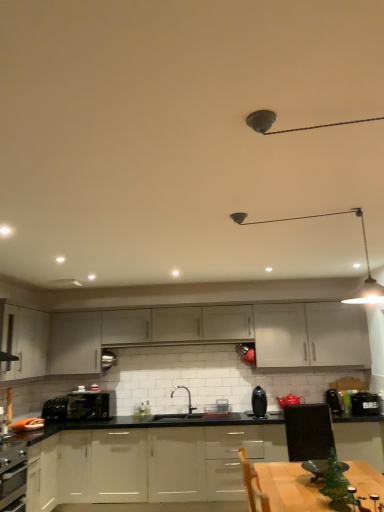
In order to click on white matte cabinet at center, positioned as the first cabinetry in top-to-bottom order in this screenshot , I will do `click(178, 324)`.

The height and width of the screenshot is (512, 384). Describe the element at coordinates (365, 254) in the screenshot. I see `metallic pendant light at upper center` at that location.

Identify the location of green matte christmas tree at lower right. (336, 484).

Identify the location of white glossy cabinets at center, which is the fourth cabinetry from top to bottom. The image size is (384, 512). (148, 464).

You are a GUI agent. You are given a task and a screenshot of the screen. Output one action in this format:
    pyautogui.click(x=<x>, y=<y>)
    Task: Click on the white matte cabinet at center, positioned as the first cabinetry in top-to-bottom order
    The image size is (384, 512).
    Given the screenshot: What is the action you would take?
    pyautogui.click(x=178, y=324)

Can you confirm if metallic silver toaster at center, placed as the 1th kitchen appliance when sorted from left to right, is positioned to the right of satin black vase at center, which appears as the 1th kitchen appliance when viewed from the front?

No, metallic silver toaster at center, placed as the 1th kitchen appliance when sorted from left to right, is not to the right of satin black vase at center, which appears as the 1th kitchen appliance when viewed from the front.

Between metallic silver toaster at center, acting as the second kitchen appliance starting from the right, and satin black vase at center, the 2th kitchen appliance viewed from the back, which one is positioned behind?

metallic silver toaster at center, acting as the second kitchen appliance starting from the right.

Considering the sizes of objects metallic silver toaster at center, which is the 2th kitchen appliance in front-to-back order, and satin black vase at center, which appears as the 1th kitchen appliance when viewed from the front, in the image provided, who is smaller, metallic silver toaster at center, which is the 2th kitchen appliance in front-to-back order, or satin black vase at center, which appears as the 1th kitchen appliance when viewed from the front,?

satin black vase at center, which appears as the 1th kitchen appliance when viewed from the front, is smaller.

Which object is positioned more to the left, metallic silver kettle at right, arranged as the first appliance when viewed from the right, or white matte cabinet at center, positioned as the first cabinetry in top-to-bottom order?

From the viewer's perspective, white matte cabinet at center, positioned as the first cabinetry in top-to-bottom order, appears more on the left side.

Is metallic silver kettle at right, arranged as the first appliance when viewed from the right, turned away from white matte cabinet at center, positioned as the first cabinetry in top-to-bottom order?

No, metallic silver kettle at right, arranged as the first appliance when viewed from the right,'s orientation is not away from white matte cabinet at center, positioned as the first cabinetry in top-to-bottom order.

From the image's perspective, starting from the white matte cabinet at center, the 4th cabinetry in the bottom-to-top sequence, which appliance is the 1st one below? Please provide its 2D coordinates.

[(334, 401)]

Could white matte cabinet at center, the 4th cabinetry in the bottom-to-top sequence, be considered to be inside metallic silver kettle at right, which appears as the first appliance when viewed from the front?

A: No, white matte cabinet at center, the 4th cabinetry in the bottom-to-top sequence, is not surrounded by metallic silver kettle at right, which appears as the first appliance when viewed from the front.

Are white glossy cabinets at center, marked as the first cabinetry in a bottom-to-top arrangement, and satin black vase at center, which appears as the 1th kitchen appliance when viewed from the front, located far from each other?

white glossy cabinets at center, marked as the first cabinetry in a bottom-to-top arrangement, is far away from satin black vase at center, which appears as the 1th kitchen appliance when viewed from the front.

Between white glossy cabinets at center, which is the fourth cabinetry from top to bottom, and satin black vase at center, the 1th kitchen appliance when ordered from right to left, which one appears on the left side from the viewer's perspective?

white glossy cabinets at center, which is the fourth cabinetry from top to bottom, is more to the left.

From a real-world perspective, is white glossy cabinets at center, marked as the first cabinetry in a bottom-to-top arrangement, positioned over satin black vase at center, the 2th kitchen appliance viewed from the back, based on gravity?

No, from a real-world perspective, white glossy cabinets at center, marked as the first cabinetry in a bottom-to-top arrangement, is not on top of satin black vase at center, the 2th kitchen appliance viewed from the back.

Is white glossy cabinets at center, which is the fourth cabinetry from top to bottom, looking in the opposite direction of satin black vase at center, the 1th kitchen appliance when ordered from right to left?

No, white glossy cabinets at center, which is the fourth cabinetry from top to bottom, is not facing away from satin black vase at center, the 1th kitchen appliance when ordered from right to left.

How different are the orientations of green matte christmas tree at lower right and white matte cabinet at center, the 4th cabinetry in the bottom-to-top sequence, in degrees?

74.5 degrees.

Considering the relative sizes of green matte christmas tree at lower right and white matte cabinet at center, the 4th cabinetry in the bottom-to-top sequence, in the image provided, is green matte christmas tree at lower right taller than white matte cabinet at center, the 4th cabinetry in the bottom-to-top sequence,?

No.

Between green matte christmas tree at lower right and white matte cabinet at center, the 4th cabinetry in the bottom-to-top sequence, which one appears on the right side from the viewer's perspective?

From the viewer's perspective, green matte christmas tree at lower right appears more on the right side.

Would you say green matte christmas tree at lower right is inside or outside white matte cabinet at center, the 4th cabinetry in the bottom-to-top sequence?

green matte christmas tree at lower right is located beyond the bounds of white matte cabinet at center, the 4th cabinetry in the bottom-to-top sequence.

Who is shorter, green matte christmas tree at lower right or black plastic toaster at lower left, which ranks as the second appliance in right-to-left order?

With less height is black plastic toaster at lower left, which ranks as the second appliance in right-to-left order.

Where is `christmas tree above the black plastic toaster at lower left, which is counted as the second appliance, starting from the front (from the image's perspective)`? The image size is (384, 512). christmas tree above the black plastic toaster at lower left, which is counted as the second appliance, starting from the front (from the image's perspective) is located at coordinates point(336,484).

Between green matte christmas tree at lower right and black plastic toaster at lower left, placed as the 1th appliance when sorted from left to right, which one has larger width?

black plastic toaster at lower left, placed as the 1th appliance when sorted from left to right.

Does green matte christmas tree at lower right contain black plastic toaster at lower left, marked as the 1th appliance in a back-to-front arrangement?

No, green matte christmas tree at lower right does not contain black plastic toaster at lower left, marked as the 1th appliance in a back-to-front arrangement.

In the image, is green matte christmas tree at lower right positioned in front of or behind metallic silver toaster at center, which is the 2th kitchen appliance in front-to-back order?

In the image, green matte christmas tree at lower right appears in front of metallic silver toaster at center, which is the 2th kitchen appliance in front-to-back order.

Is green matte christmas tree at lower right far from metallic silver toaster at center, acting as the second kitchen appliance starting from the right?

Yes, green matte christmas tree at lower right is far from metallic silver toaster at center, acting as the second kitchen appliance starting from the right.

Where is `the 2nd kitchen appliance counting from the left side of the green matte christmas tree at lower right`? The height and width of the screenshot is (512, 384). the 2nd kitchen appliance counting from the left side of the green matte christmas tree at lower right is located at coordinates (91, 405).

Is green matte christmas tree at lower right facing away from metallic silver toaster at center, placed as the 1th kitchen appliance when sorted from left to right?

That's not correct — green matte christmas tree at lower right is not looking away from metallic silver toaster at center, placed as the 1th kitchen appliance when sorted from left to right.

Can you confirm if metallic silver toaster at center, placed as the 1th kitchen appliance when sorted from left to right, is positioned to the right of metallic silver kettle at right, arranged as the second appliance when viewed from the left?

Incorrect, metallic silver toaster at center, placed as the 1th kitchen appliance when sorted from left to right, is not on the right side of metallic silver kettle at right, arranged as the second appliance when viewed from the left.

Is metallic silver kettle at right, arranged as the first appliance when viewed from the right, at the back of metallic silver toaster at center, which ranks as the first kitchen appliance in back-to-front order?

Answer: No, metallic silver toaster at center, which ranks as the first kitchen appliance in back-to-front order,'s orientation is not away from metallic silver kettle at right, arranged as the first appliance when viewed from the right.

From a real-world perspective, does metallic silver toaster at center, which ranks as the first kitchen appliance in back-to-front order, stand above metallic silver kettle at right, which appears as the first appliance when viewed from the front?

Yes, from a real-world perspective, metallic silver toaster at center, which ranks as the first kitchen appliance in back-to-front order, is on top of metallic silver kettle at right, which appears as the first appliance when viewed from the front.

Who is shorter, metallic silver toaster at center, placed as the 1th kitchen appliance when sorted from left to right, or metallic silver kettle at right, which appears as the first appliance when viewed from the front?

Standing shorter between the two is metallic silver kettle at right, which appears as the first appliance when viewed from the front.

The image size is (384, 512). There is a metallic silver toaster at center, placed as the 1th kitchen appliance when sorted from left to right. Find the location of `kitchen appliance above it (from a real-world perspective)`. kitchen appliance above it (from a real-world perspective) is located at coordinates (259, 402).

From the image's perspective, which appliance is the 1st one below the white matte cabinet at center, positioned as the first cabinetry in top-to-bottom order? Please provide its 2D coordinates.

[(334, 401)]

Estimate the real-world distances between objects in this image. Which object is closer to white matte cabinet at center, arranged as the second cabinetry when viewed from the top, metallic silver toaster at center, which is the 2th kitchen appliance in front-to-back order, or matte gray cabinet at center, the 3th cabinetry when ordered from top to bottom?

metallic silver toaster at center, which is the 2th kitchen appliance in front-to-back order.

Looking at the image, which one is located closer to green matte christmas tree at lower right, white matte cabinet at center, the 4th cabinetry in the bottom-to-top sequence, or metallic silver kettle at right, arranged as the second appliance when viewed from the left?

Based on the image, metallic silver kettle at right, arranged as the second appliance when viewed from the left, appears to be nearer to green matte christmas tree at lower right.

Which object lies further to the anchor point matte gray cabinet at center, which is the 2th cabinetry from bottom to top, white matte cabinet at center, arranged as the second cabinetry when viewed from the top, or metallic pendant light at upper center?

metallic pendant light at upper center is further to matte gray cabinet at center, which is the 2th cabinetry from bottom to top.

From the image, which object appears to be nearer to metallic silver toaster at center, acting as the second kitchen appliance starting from the right, satin black vase at center, the 2th kitchen appliance viewed from the back, or white matte cabinet at center, arranged as the second cabinetry when viewed from the top?

satin black vase at center, the 2th kitchen appliance viewed from the back, is positioned closer to the anchor metallic silver toaster at center, acting as the second kitchen appliance starting from the right.

From the image, which object appears to be nearer to black plastic toaster at lower left, which is counted as the second appliance, starting from the front, white glossy cabinets at center, which is the fourth cabinetry from top to bottom, or green matte christmas tree at lower right?

white glossy cabinets at center, which is the fourth cabinetry from top to bottom, lies closer to black plastic toaster at lower left, which is counted as the second appliance, starting from the front, than the other object.

Considering their positions, is satin black vase at center, the 2th kitchen appliance viewed from the left, positioned further to white matte cabinet at center, the third cabinetry in the bottom-to-top sequence, than matte gray cabinet at center, which is the 2th cabinetry from bottom to top?

matte gray cabinet at center, which is the 2th cabinetry from bottom to top.

Considering their positions, is matte gray cabinet at center, which is the 2th cabinetry from bottom to top, positioned further to satin black vase at center, the 1th kitchen appliance when ordered from right to left, than metallic silver kettle at right, which appears as the first appliance when viewed from the front?

matte gray cabinet at center, which is the 2th cabinetry from bottom to top, is positioned further to the anchor satin black vase at center, the 1th kitchen appliance when ordered from right to left.

When comparing their distances from white glossy cabinets at center, which is the fourth cabinetry from top to bottom, does metallic silver kettle at right, the second appliance when ordered from back to front, or metallic pendant light at upper center seem closer?

metallic silver kettle at right, the second appliance when ordered from back to front, is closer to white glossy cabinets at center, which is the fourth cabinetry from top to bottom.

Where is `christmas tree situated between matte gray cabinet at center, the 3th cabinetry when ordered from top to bottom, and metallic silver kettle at right, arranged as the first appliance when viewed from the right, from left to right`? The height and width of the screenshot is (512, 384). christmas tree situated between matte gray cabinet at center, the 3th cabinetry when ordered from top to bottom, and metallic silver kettle at right, arranged as the first appliance when viewed from the right, from left to right is located at coordinates (336, 484).

Identify the location of christmas tree between metallic pendant light at upper center and white glossy cabinets at center, which is the fourth cabinetry from top to bottom, vertically. (336, 484).

I want to click on cabinetry between metallic pendant light at upper center and white matte cabinet at center, the third cabinetry in the bottom-to-top sequence, along the z-axis, so click(x=148, y=464).

Identify the location of kitchen appliance between metallic silver toaster at center, placed as the 1th kitchen appliance when sorted from left to right, and white matte cabinet at center, the third cabinetry in the bottom-to-top sequence. The image size is (384, 512). (259, 402).